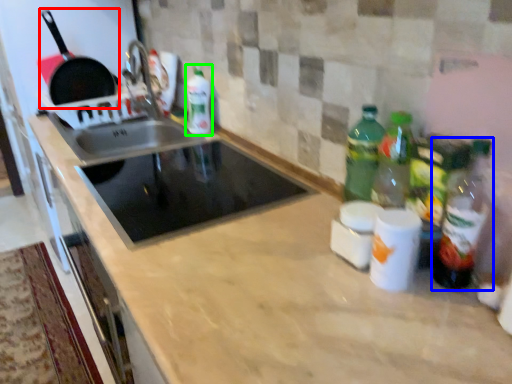
Question: Which object is positioned closest to frying pan (highlighted by a red box)? Select from bottle (highlighted by a blue box) and bottle (highlighted by a green box).

Choices:
 (A) bottle
 (B) bottle

Answer: (B)